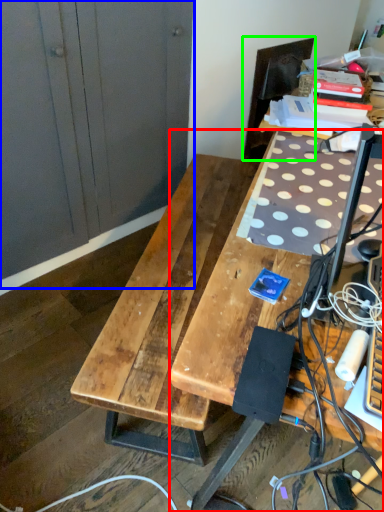
Question: Which object is positioned farthest from desk (highlighted by a red box)? Select from dresser (highlighted by a blue box) and swivel chair (highlighted by a green box).

Choices:
 (A) dresser
 (B) swivel chair

Answer: (B)